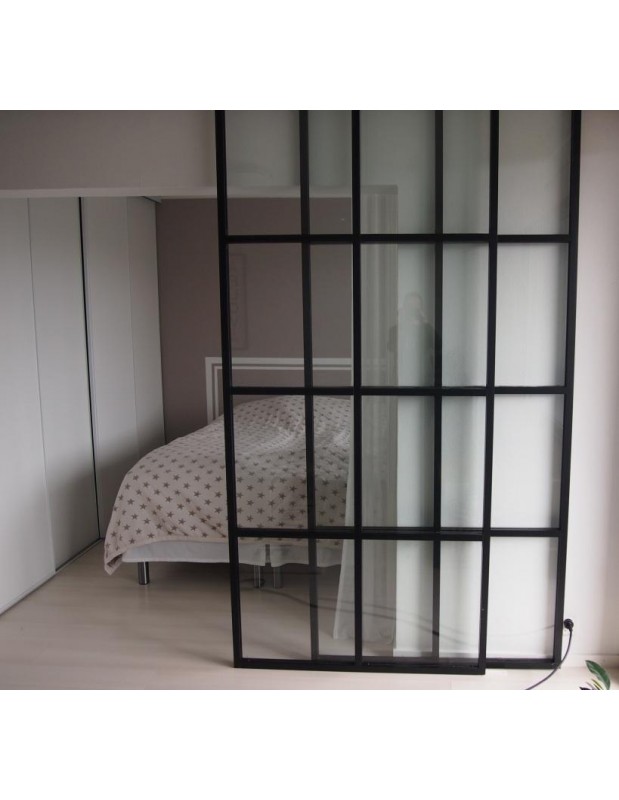
Where is `cable`? The height and width of the screenshot is (800, 619). cable is located at coordinates (569, 628).